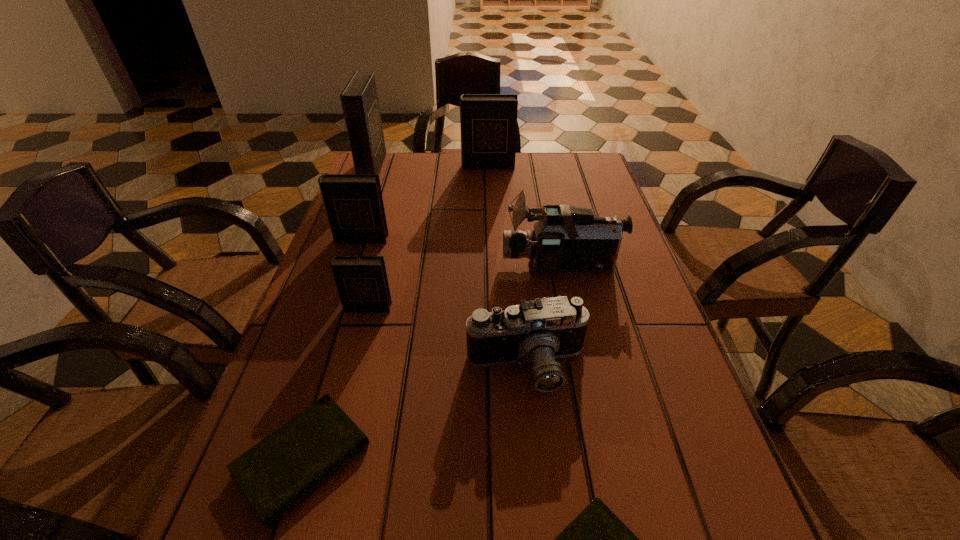
Image resolution: width=960 pixels, height=540 pixels. Find the location of `vacant space situated 0.140m on the right of the bigger green diary`. vacant space situated 0.140m on the right of the bigger green diary is located at coordinates (454, 458).

Identify the location of object present at the right edge. (565, 238).

This screenshot has width=960, height=540. I want to click on object situated at the far left corner, so click(359, 99).

You are a GUI agent. You are given a task and a screenshot of the screen. Output one action in this format:
    pyautogui.click(x=<x>, y=<y>)
    Task: Click on the free space at the far edge of the desktop
    The width and height of the screenshot is (960, 540).
    Given the screenshot: What is the action you would take?
    pyautogui.click(x=513, y=181)

The height and width of the screenshot is (540, 960). In the image, there is a desktop. In order to click on vacant space at the left edge in this screenshot , I will do `click(351, 248)`.

The width and height of the screenshot is (960, 540). I want to click on blank area at the right edge, so click(x=589, y=200).

What are the coordinates of `vacant space at the far left corner of the desktop` in the screenshot? It's located at (388, 179).

In the image, there is a desktop. Find the location of `vacant space at the far right corner`. vacant space at the far right corner is located at coordinates (595, 168).

Locate an element on the screen. This screenshot has height=540, width=960. free space between the biggest dark diary and the rightmost dark diary is located at coordinates (430, 167).

Where is `unoccupied area between the fifth shortest diary and the nearest dark diary`? Image resolution: width=960 pixels, height=540 pixels. unoccupied area between the fifth shortest diary and the nearest dark diary is located at coordinates click(427, 237).